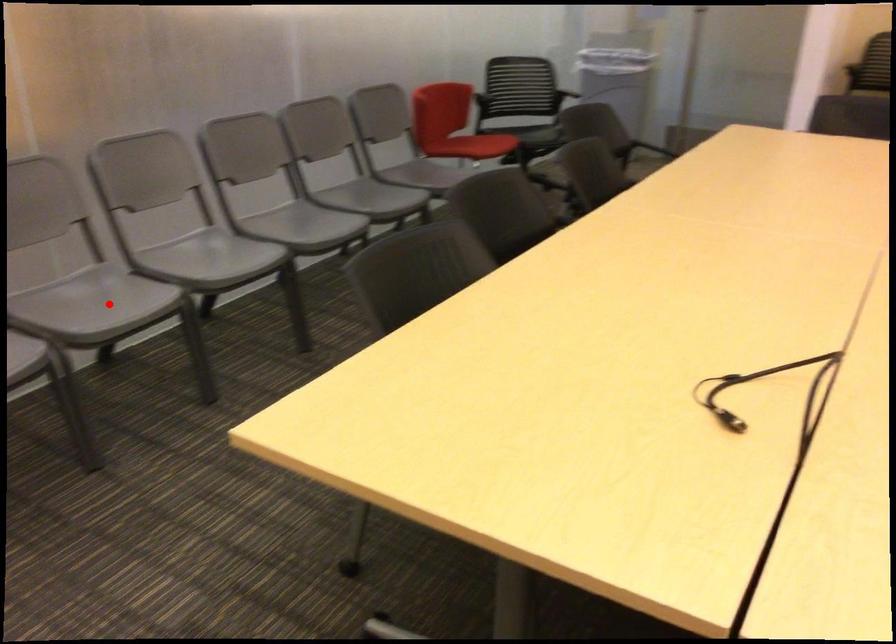
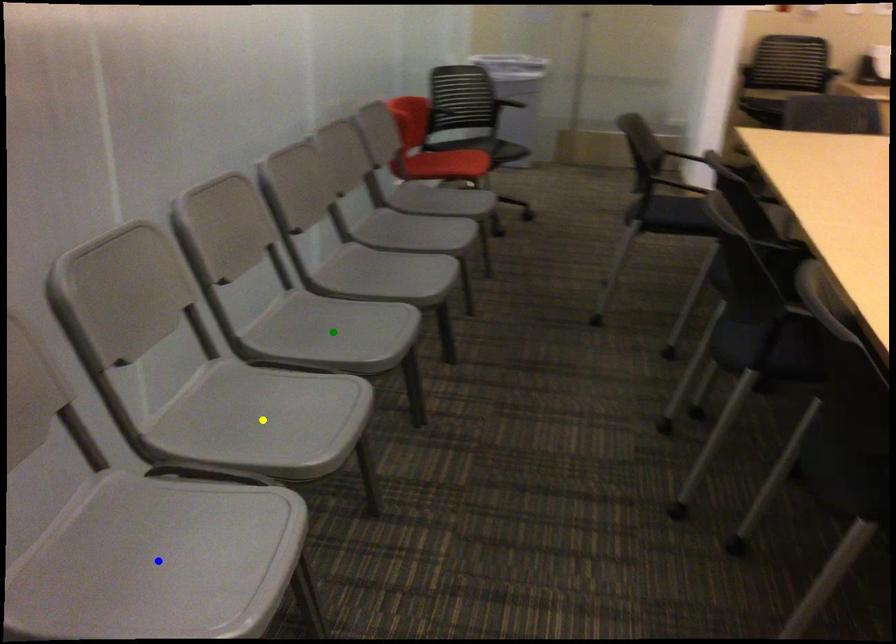
Question: I am providing you with two images of the same scene from different viewpoints. A red point is marked on the first image. You are given multiple points on the second image. Which spot in image 2 lines up with the point in image 1?

Choices:
 (A) blue point
 (B) yellow point
 (C) green point

Answer: (B)